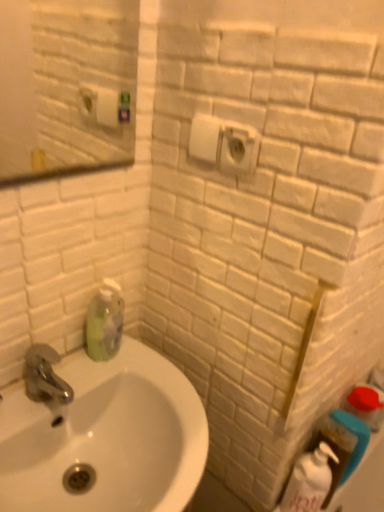
Question: Is white plastic electric outlet at upper center facing away from white glossy bottle at lower right, positioned as the 1th cleaning product in bottom-to-top order?

Choices:
 (A) no
 (B) yes

Answer: (A)

Question: From the image's perspective, would you say white plastic electric outlet at upper center is positioned over white glossy bottle at lower right, which is the first cleaning product from right to left?

Choices:
 (A) yes
 (B) no

Answer: (A)

Question: Considering the relative sizes of white plastic electric outlet at upper center and white glossy bottle at lower right, positioned as the 1th cleaning product in bottom-to-top order, in the image provided, is white plastic electric outlet at upper center taller than white glossy bottle at lower right, positioned as the 1th cleaning product in bottom-to-top order,?

Choices:
 (A) yes
 (B) no

Answer: (B)

Question: Can you see white plastic electric outlet at upper center touching white glossy bottle at lower right, the 2th cleaning product positioned from the left?

Choices:
 (A) no
 (B) yes

Answer: (A)

Question: Is white plastic electric outlet at upper center closer to the viewer compared to white glossy bottle at lower right, the 2th cleaning product positioned from the left?

Choices:
 (A) yes
 (B) no

Answer: (A)

Question: In terms of size, does white glossy bottle at lower right, the 2th cleaning product in the top-to-bottom sequence, appear bigger or smaller than white glossy sink at lower left?

Choices:
 (A) big
 (B) small

Answer: (B)

Question: Considering the positions of white glossy bottle at lower right, positioned as the 1th cleaning product in bottom-to-top order, and white glossy sink at lower left in the image, is white glossy bottle at lower right, positioned as the 1th cleaning product in bottom-to-top order, wider or thinner than white glossy sink at lower left?

Choices:
 (A) thin
 (B) wide

Answer: (A)

Question: Would you say white glossy bottle at lower right, positioned as the 1th cleaning product in bottom-to-top order, is to the left or to the right of white glossy sink at lower left in the picture?

Choices:
 (A) left
 (B) right

Answer: (B)

Question: Relative to white glossy sink at lower left, is white glossy bottle at lower right, the 2th cleaning product in the top-to-bottom sequence, in front or behind?

Choices:
 (A) front
 (B) behind

Answer: (B)

Question: From a real-world perspective, is white glossy bottle at lower right, the 2th cleaning product in the top-to-bottom sequence, positioned above or below green matte bottle at lower left, the 2th cleaning product from the bottom?

Choices:
 (A) below
 (B) above

Answer: (A)

Question: From the image's perspective, is white glossy bottle at lower right, which is the first cleaning product from right to left, above or below green matte bottle at lower left, which is the second cleaning product from right to left?

Choices:
 (A) below
 (B) above

Answer: (A)

Question: Based on their positions, is white glossy bottle at lower right, the 2th cleaning product positioned from the left, located to the left or right of green matte bottle at lower left, the 1th cleaning product viewed from the left?

Choices:
 (A) right
 (B) left

Answer: (A)

Question: Is point (299, 458) positioned closer to the camera than point (104, 303)?

Choices:
 (A) closer
 (B) farther

Answer: (A)

Question: Is white glossy sink at lower left spatially inside white glossy bottle at lower right, the 2th cleaning product in the top-to-bottom sequence, or outside of it?

Choices:
 (A) outside
 (B) inside

Answer: (A)

Question: From a real-world perspective, is white glossy sink at lower left above or below white glossy bottle at lower right, positioned as the 1th cleaning product in bottom-to-top order?

Choices:
 (A) above
 (B) below

Answer: (A)